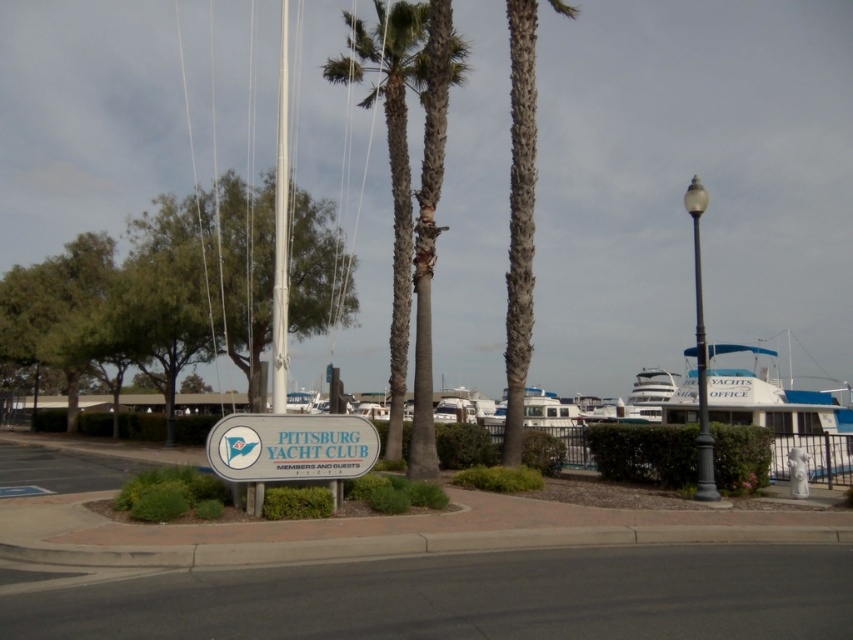
Question: Can you confirm if green leafy tree at left is wider than white plastic sign at center?

Choices:
 (A) yes
 (B) no

Answer: (A)

Question: Estimate the real-world distances between objects in this image. Which object is farther from the white glossy yacht at center-right?

Choices:
 (A) white plastic sign at center
 (B) white glossy boat at center
 (C) brown textured palm tree at center
 (D) green textured palm tree at center

Answer: (A)

Question: Can you confirm if gray textured palm tree at center is bigger than white glossy boat at center?

Choices:
 (A) yes
 (B) no

Answer: (B)

Question: Which object is closer to the camera taking this photo?

Choices:
 (A) white glossy yacht at center-right
 (B) brown textured palm tree at center

Answer: (A)

Question: Among these objects, which one is farthest from the camera?

Choices:
 (A) white glossy boat at center
 (B) white glossy yacht at center-right
 (C) white plastic sign at center

Answer: (A)

Question: Is the position of green leafy tree at left less distant than that of green textured palm tree at center?

Choices:
 (A) no
 (B) yes

Answer: (A)